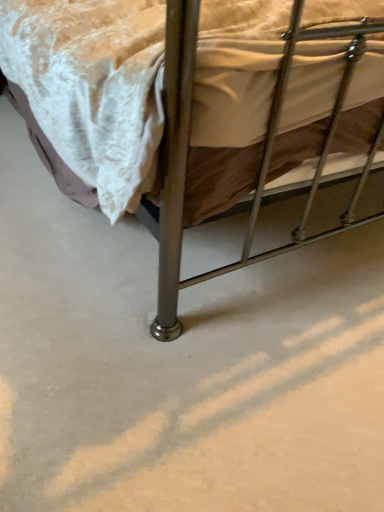
This screenshot has height=512, width=384. Describe the element at coordinates (209, 98) in the screenshot. I see `metallic bed frame at center` at that location.

Locate an element on the screen. The image size is (384, 512). metallic bed frame at center is located at coordinates (209, 98).

Measure the distance between metallic bed frame at center and camera.

metallic bed frame at center is 27.14 inches away from camera.

The width and height of the screenshot is (384, 512). In order to click on metallic bed frame at center in this screenshot , I will do `click(209, 98)`.